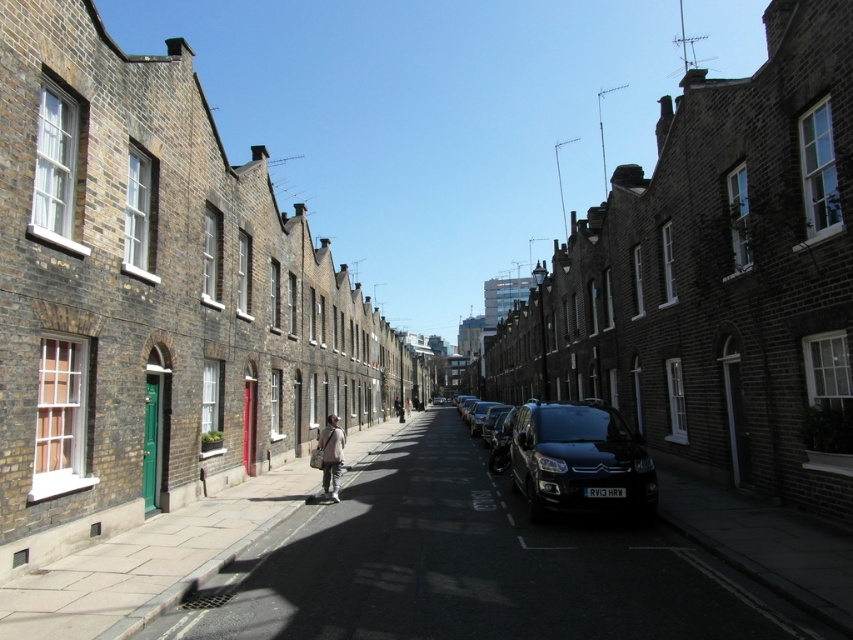
You are driving a car and see the dark gray concrete pavement at center and the shiny black van at center. Which object is closer to you?

The dark gray concrete pavement at center is closer to you because it is in front of the shiny black van at center.

You are a pedestrian standing on the sidewalk and see a shiny black van at center and a light beige fabric jacket at center. Which object is nearer to you?

The shiny black van at center is closer to the viewer than the light beige fabric jacket at center.

You are a delivery driver who needs to park your shiny black van at center in a parking bay on the dark gray concrete pavement at center. Will the van fit entirely within the pavement area?

The dark gray concrete pavement at center is larger in size than the shiny black van at center, so the van will fit entirely within the pavement area.